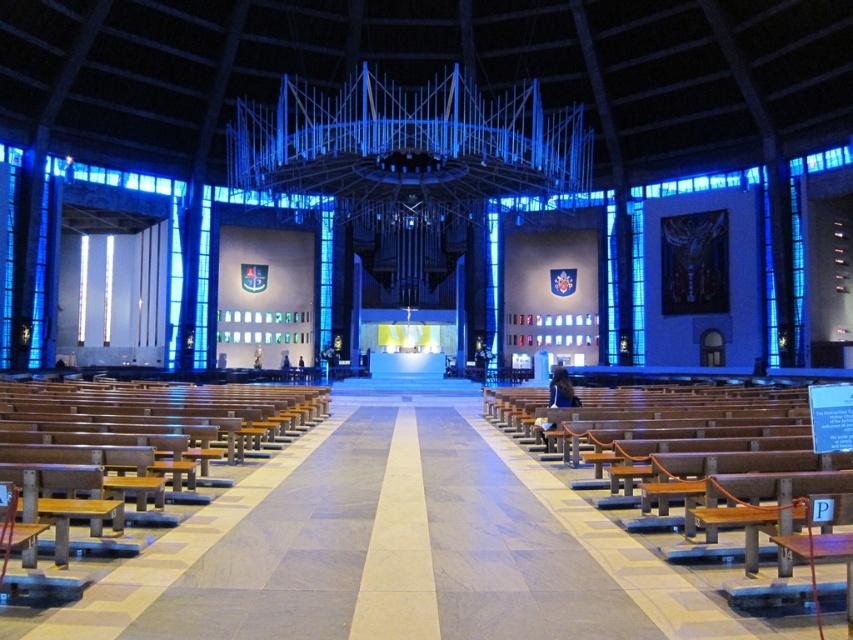
Question: Does wooden polished bench at center appear on the right side of brown wooden bench at left?

Choices:
 (A) yes
 (B) no

Answer: (A)

Question: Is wooden polished bench at center to the right of brown wooden bench at left from the viewer's perspective?

Choices:
 (A) yes
 (B) no

Answer: (A)

Question: Which point is farther to the camera?

Choices:
 (A) (99, 428)
 (B) (634, 465)

Answer: (B)

Question: Considering the relative positions of wooden polished bench at center and brown wooden bench at left in the image provided, where is wooden polished bench at center located with respect to brown wooden bench at left?

Choices:
 (A) right
 (B) left

Answer: (A)

Question: Which object appears farthest from the camera in this image?

Choices:
 (A) brown wooden bench at left
 (B) wooden polished bench at center

Answer: (A)